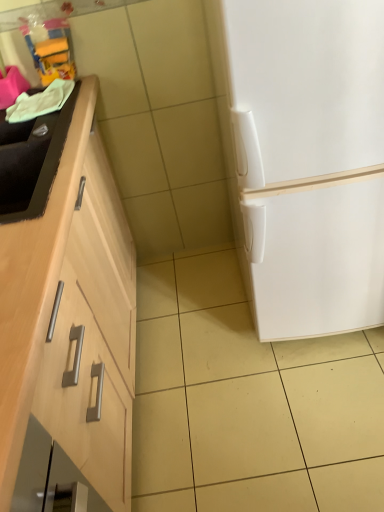
Find the location of a particular element. The image size is (384, 512). white matte refrigerator at right is located at coordinates (304, 158).

The image size is (384, 512). Describe the element at coordinates (304, 158) in the screenshot. I see `white matte refrigerator at right` at that location.

The width and height of the screenshot is (384, 512). Find the location of `black matte sink at left`. black matte sink at left is located at coordinates (31, 162).

Measure the distance between black matte sink at left and camera.

A distance of 87.07 centimeters exists between black matte sink at left and camera.

In order to face black matte sink at left, should I rotate leftwards or rightwards?

Rotate your view left by about 22.524°.

This screenshot has height=512, width=384. What do you see at coordinates (31, 162) in the screenshot?
I see `black matte sink at left` at bounding box center [31, 162].

Where is `white matte refrigerator at right`? The image size is (384, 512). white matte refrigerator at right is located at coordinates (304, 158).

In the image, is black matte sink at left on the left side or the right side of white matte refrigerator at right?

black matte sink at left is to the left of white matte refrigerator at right.

Does black matte sink at left come behind white matte refrigerator at right?

Yes, it is.

Is point (37, 139) positioned behind point (229, 162)?

No, (37, 139) is in front of (229, 162).

From the image's perspective, which one is positioned lower, black matte sink at left or white matte refrigerator at right?

black matte sink at left, from the image's perspective.

From a real-world perspective, does black matte sink at left stand above white matte refrigerator at right?

Correct, in the physical world, black matte sink at left is higher than white matte refrigerator at right.

In terms of width, does black matte sink at left look wider or thinner when compared to white matte refrigerator at right?

black matte sink at left is thinner than white matte refrigerator at right.

Who is shorter, black matte sink at left or white matte refrigerator at right?

Standing shorter between the two is black matte sink at left.

From the picture: Considering the sizes of objects black matte sink at left and white matte refrigerator at right in the image provided, who is smaller, black matte sink at left or white matte refrigerator at right?

black matte sink at left.

Choose the correct answer: Is black matte sink at left inside white matte refrigerator at right or outside it?

black matte sink at left is outside white matte refrigerator at right.

Is black matte sink at left beside white matte refrigerator at right?

No, black matte sink at left is not touching white matte refrigerator at right.

Looking at this image, is white matte refrigerator at right at the back of black matte sink at left?

No, black matte sink at left is not facing the opposite direction of white matte refrigerator at right.

Locate an element on the screen. refrigerator that appears in front of the black matte sink at left is located at coordinates (304, 158).

Is white matte refrigerator at right at the left side of black matte sink at left?

No, white matte refrigerator at right is not to the left of black matte sink at left.

Is the depth of white matte refrigerator at right less than that of black matte sink at left?

Yes, it is in front of black matte sink at left.

Which is farther, (325, 96) or (44, 179)?

The point (44, 179) is more distant.

Consider the image. From the image's perspective, between white matte refrigerator at right and black matte sink at left, which one is located above?

From the image's view, white matte refrigerator at right is above.

From a real-world perspective, which object stands above the other?

black matte sink at left, from a real-world perspective.

Is white matte refrigerator at right wider or thinner than black matte sink at left?

Considering their sizes, white matte refrigerator at right looks broader than black matte sink at left.

Considering the sizes of objects white matte refrigerator at right and black matte sink at left in the image provided, who is shorter, white matte refrigerator at right or black matte sink at left?

With less height is black matte sink at left.

Who is bigger, white matte refrigerator at right or black matte sink at left?

With larger size is white matte refrigerator at right.

Can black matte sink at left be found inside white matte refrigerator at right?

That's incorrect, black matte sink at left is not inside white matte refrigerator at right.

Is white matte refrigerator at right next to black matte sink at left?

No, white matte refrigerator at right is not with black matte sink at left.

Could you tell me if white matte refrigerator at right is turned towards black matte sink at left?

No, white matte refrigerator at right does not turn towards black matte sink at left.

How distant is white matte refrigerator at right from black matte sink at left?

white matte refrigerator at right is 66.12 centimeters away from black matte sink at left.

Find the location of a particular element. sink on the left of white matte refrigerator at right is located at coordinates (31, 162).

Find the location of a particular element. sink behind the white matte refrigerator at right is located at coordinates point(31,162).

The image size is (384, 512). Identify the location of sink below the white matte refrigerator at right (from the image's perspective). (31, 162).